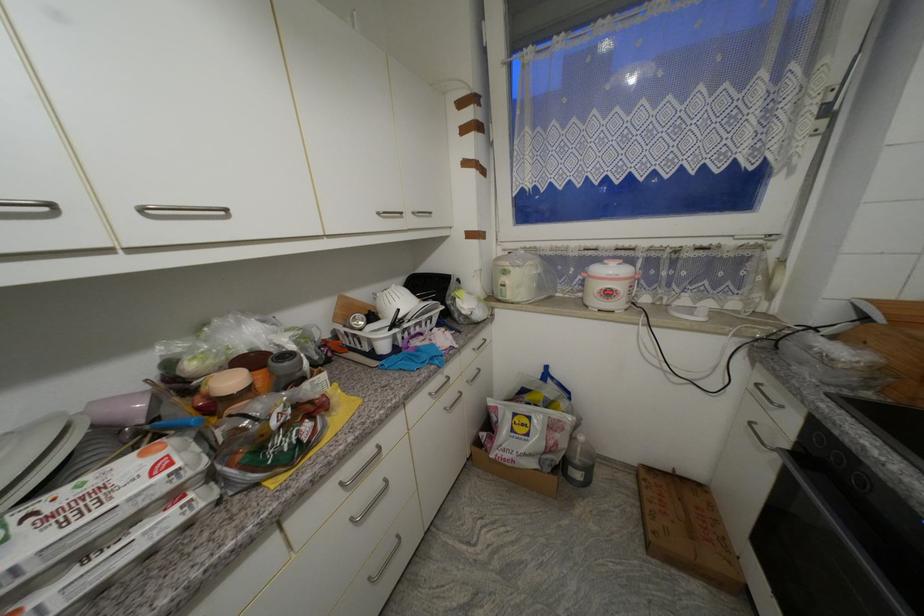
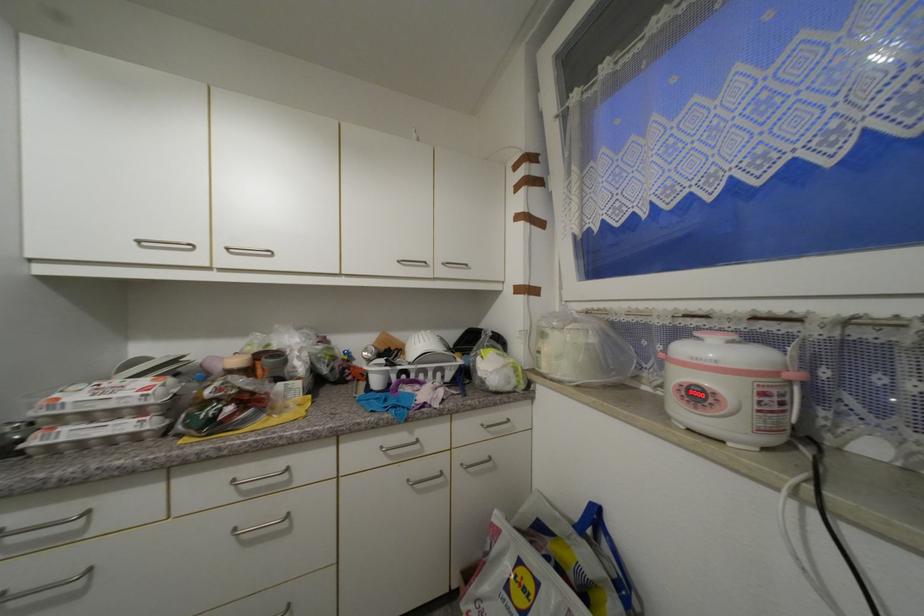
Where in the second image is the point corresponding to (390,349) from the first image?

(382, 384)